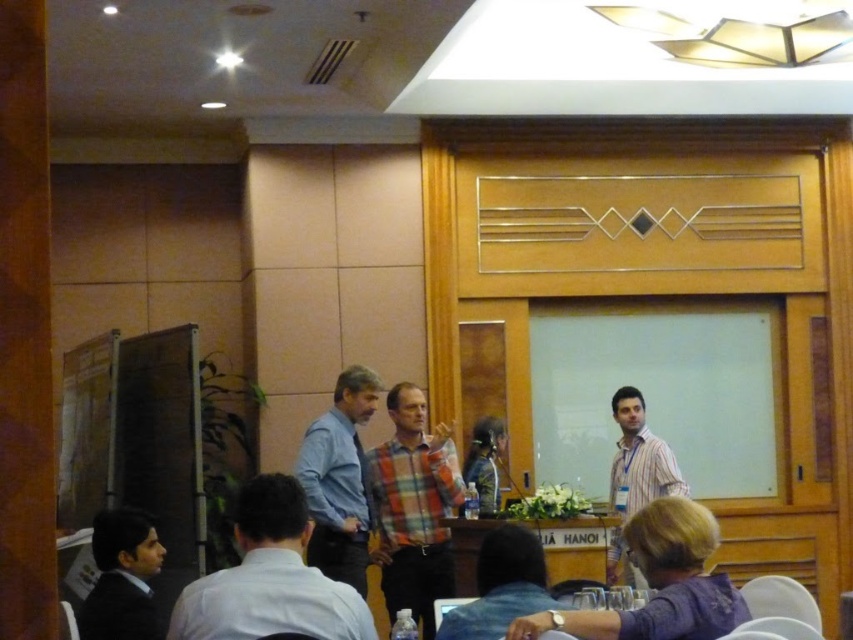
Who is taller, plaid fabric shirt at center or denim shirt at lower center?

plaid fabric shirt at center

Does plaid fabric shirt at center appear over denim shirt at lower center?

No.

Is point (421, 451) less distant than point (526, 577)?

No, it is not.

You are a GUI agent. You are given a task and a screenshot of the screen. Output one action in this format:
    pyautogui.click(x=<x>, y=<y>)
    Task: Click on the plaid fabric shirt at center
    
    Given the screenshot: What is the action you would take?
    coord(413,508)

Who is higher up, blue shirt at center or striped cotton shirt at right?

blue shirt at center is above.

The width and height of the screenshot is (853, 640). What do you see at coordinates (339, 480) in the screenshot? I see `blue shirt at center` at bounding box center [339, 480].

Locate an element on the screen. This screenshot has height=640, width=853. blue shirt at center is located at coordinates (339, 480).

Between point (425, 484) and point (550, 576), which one is positioned behind?

Point (550, 576)

Does plaid fabric shirt at center have a smaller size compared to wooden at center?

No.

Does point (405, 433) lie in front of point (569, 524)?

No, (405, 433) is behind (569, 524).

The image size is (853, 640). Identify the location of plaid fabric shirt at center. (413, 508).